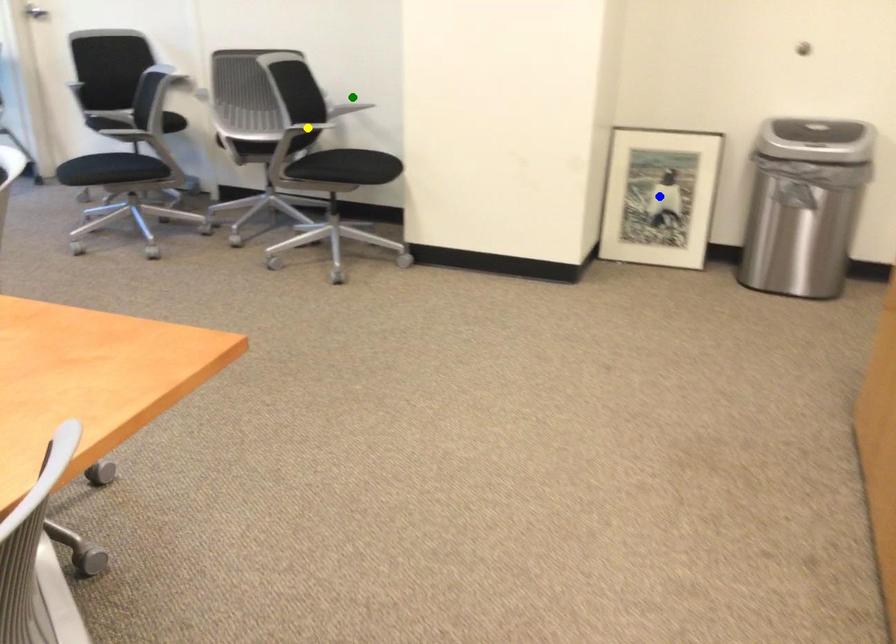
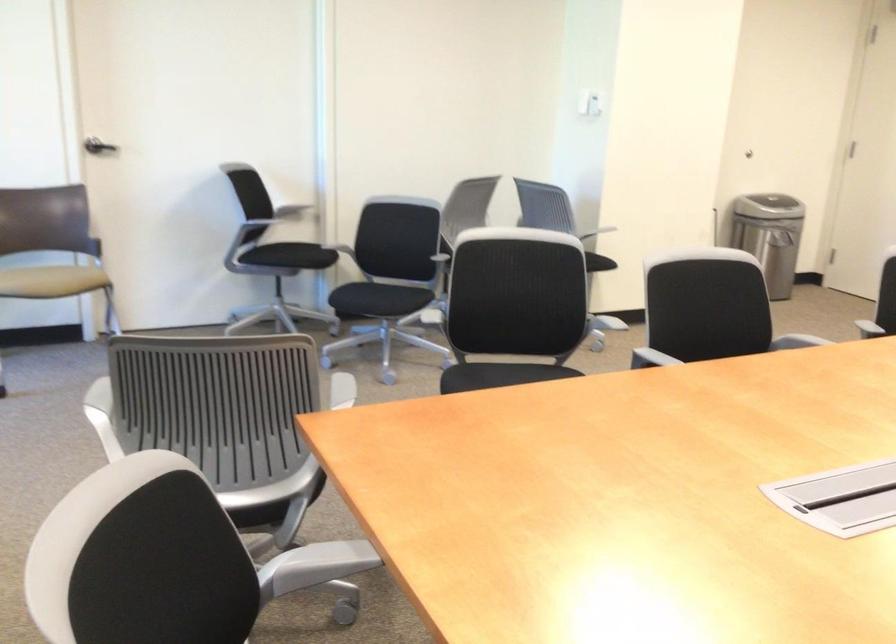
I am providing you with two images of the same scene from different viewpoints. Three points are marked in image1. Which point corresponds to a part or object that is occluded in image2?In image1, three points are marked. Which of them correspond to a part or object that is occluded in image2?Among the three points shown in image1, which one corresponds to a part or object that is no longer visible due to occlusion in image2?

yellow point, green point, blue point cannot be seen in image2.